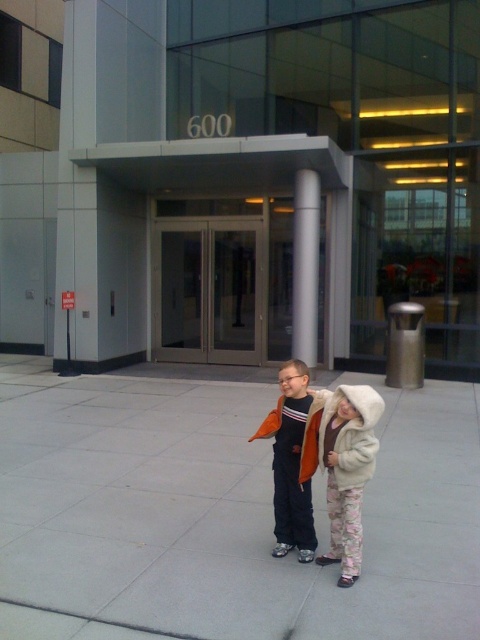
Does orange fleece jacket at center have a lesser width compared to white glossy pillar at center?

Yes, orange fleece jacket at center is thinner than white glossy pillar at center.

Who is more distant from viewer, (291, 467) or (317, 248)?

Point (317, 248)

I want to click on orange fleece jacket at center, so click(x=292, y=460).

Which is more to the left, gray concrete pavement at center or fluffy white coat at center?

Positioned to the left is gray concrete pavement at center.

Can you confirm if gray concrete pavement at center is smaller than fluffy white coat at center?

Correct, gray concrete pavement at center occupies less space than fluffy white coat at center.

Does point (307, 577) lie in front of point (346, 520)?

No, (307, 577) is further to viewer.

You are a GUI agent. You are given a task and a screenshot of the screen. Output one action in this format:
    pyautogui.click(x=<x>, y=<y>)
    Task: Click on the gray concrete pavement at center
    
    Given the screenshot: What is the action you would take?
    pyautogui.click(x=222, y=513)

Which is above, fluffy white coat at center or white glossy pillar at center?

white glossy pillar at center

Measure the distance between point [362,442] and camera.

A distance of 3.67 meters exists between point [362,442] and camera.

Between point (333, 419) and point (299, 280), which one is positioned in front?

Point (333, 419) is in front.

Where is `fluffy white coat at center`? fluffy white coat at center is located at coordinates (348, 470).